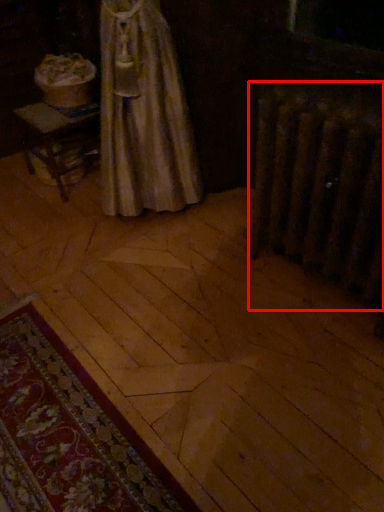
Question: Observing the image, what is the correct spatial positioning of radiator (annotated by the red box) in reference to mat?

Choices:
 (A) left
 (B) right

Answer: (B)